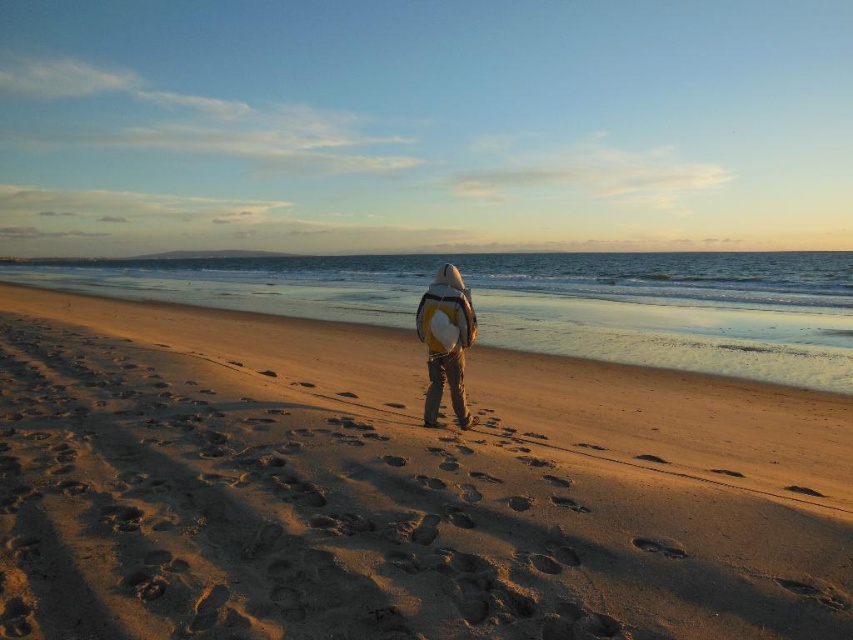
Question: Does sandy beach at center come in front of matte yellow backpack at center?

Choices:
 (A) no
 (B) yes

Answer: (B)

Question: Observing the image, what is the correct spatial positioning of sandy beach at center in reference to matte yellow backpack at center?

Choices:
 (A) above
 (B) below

Answer: (B)

Question: Does sandy beach at center appear over matte yellow backpack at center?

Choices:
 (A) no
 (B) yes

Answer: (A)

Question: Which point is farther to the camera?

Choices:
 (A) (631, 557)
 (B) (465, 413)

Answer: (B)